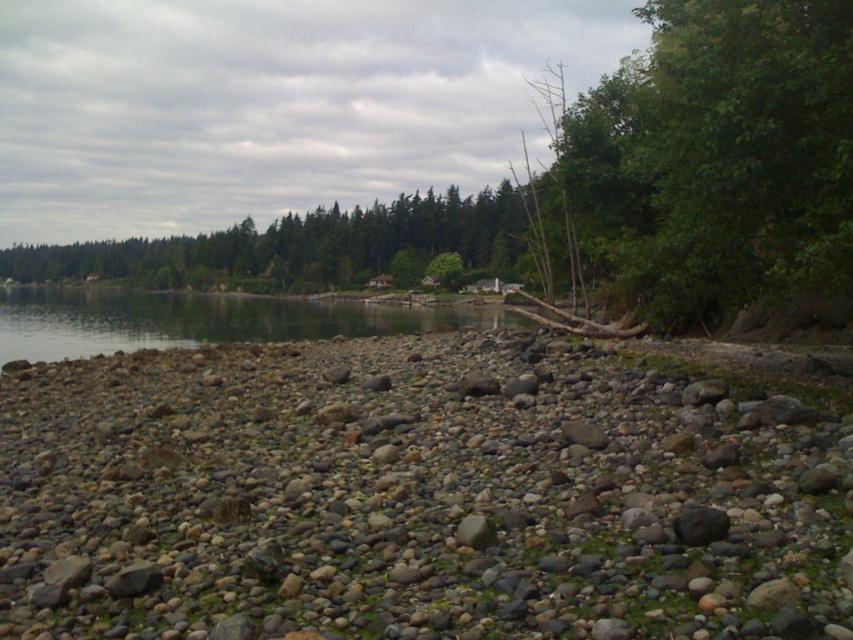
Is gray/rocky pebbles at center smaller than green leafy tree at right?

Indeed, gray/rocky pebbles at center has a smaller size compared to green leafy tree at right.

Which is behind, point (415, 417) or point (735, 6)?

The point (735, 6) is more distant.

This screenshot has width=853, height=640. Find the location of `gray/rocky pebbles at center`. gray/rocky pebbles at center is located at coordinates (413, 496).

Between green leafy tree at right and clear water at center, which one has more height?

green leafy tree at right is taller.

Is green leafy tree at right to the right of clear water at center from the viewer's perspective?

Yes, green leafy tree at right is to the right of clear water at center.

Who is more distant from viewer, (775, 129) or (280, 321)?

The point (280, 321) is more distant.

This screenshot has height=640, width=853. In order to click on green leafy tree at right in this screenshot , I will do `click(718, 161)`.

Does gray/rocky pebbles at center lie in front of clear water at center?

Yes, gray/rocky pebbles at center is in front of clear water at center.

Does gray/rocky pebbles at center have a greater height compared to clear water at center?

No, gray/rocky pebbles at center is not taller than clear water at center.

The height and width of the screenshot is (640, 853). Find the location of `gray/rocky pebbles at center`. gray/rocky pebbles at center is located at coordinates (413, 496).